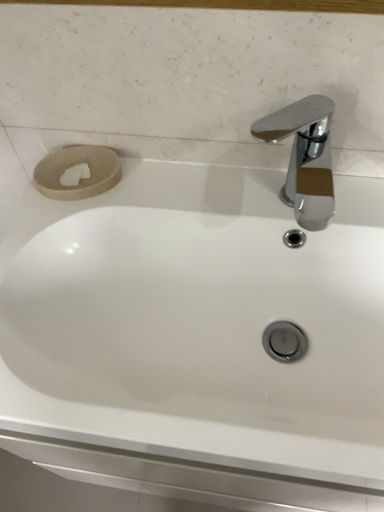
Locate an element on the screen. This screenshot has width=384, height=512. free area in between chrome/metallic faucet at upper right and beige matte toilet paper at upper left is located at coordinates (174, 190).